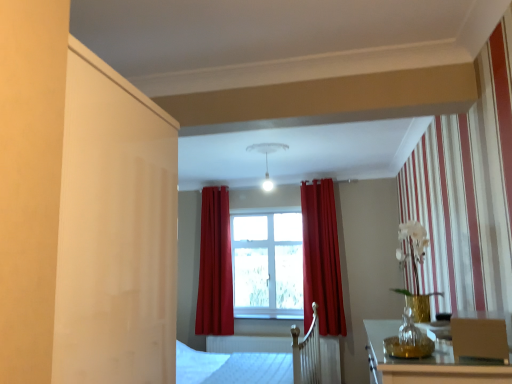
I want to click on free space above clear glass window at center (from a real-world perspective), so click(261, 204).